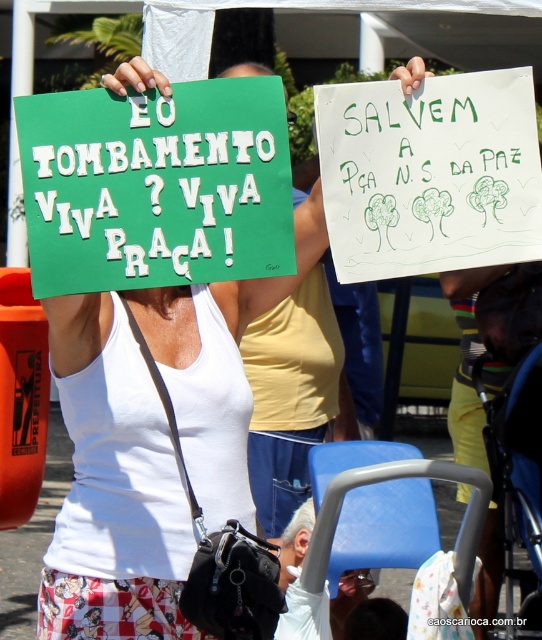
Does green paper sign at center come behind gray hair at center?

No, green paper sign at center is in front of gray hair at center.

Does point (254, 77) come farther from viewer compared to point (301, 529)?

That is False.

What do you see at coordinates (156, 186) in the screenshot? I see `green paper sign at center` at bounding box center [156, 186].

Where is `green paper sign at center`? green paper sign at center is located at coordinates (156, 186).

How far apart are white fabric tank top at center and dark brown hair at center?

A distance of 2.22 meters exists between white fabric tank top at center and dark brown hair at center.

Does point (321, 204) come in front of point (380, 632)?

Yes, point (321, 204) is closer to viewer.

This screenshot has height=640, width=542. In order to click on white fabric tank top at center in this screenshot , I will do `click(112, 486)`.

Where is `white fabric tank top at center`? white fabric tank top at center is located at coordinates (112, 486).

Is point (414, 188) closer to viewer compared to point (313, 520)?

Yes, it is in front of point (313, 520).

Is white paper sign at upper center bigger than gray hair at center?

Correct, white paper sign at upper center is larger in size than gray hair at center.

The image size is (542, 640). Find the location of `white paper sign at upper center`. white paper sign at upper center is located at coordinates (429, 173).